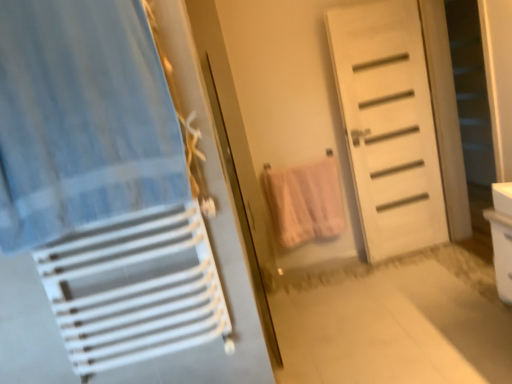
At what (x,y) coordinates should I click in order to perform the action: click on free point below white matte door at center (from a real-world perspective). Please return your answer as a coordinate pair (x, y). Looking at the image, I should click on (409, 252).